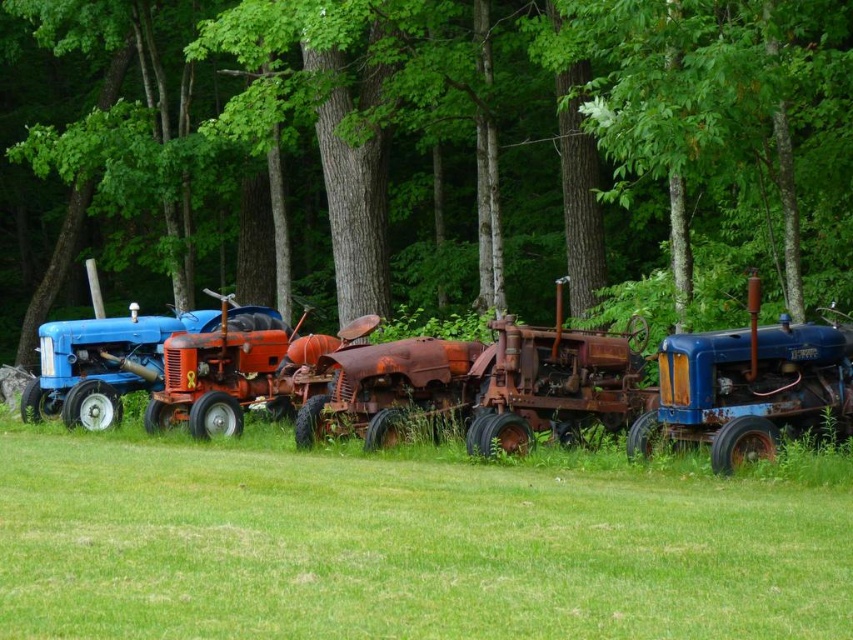
Question: Is green grass at center positioned at the back of rusty metal tractor at center?

Choices:
 (A) no
 (B) yes

Answer: (A)

Question: Can you confirm if green grass at center is positioned to the left of blue matte tractor at right?

Choices:
 (A) yes
 (B) no

Answer: (A)

Question: Which point is farther from the camera taking this photo?

Choices:
 (A) (753, 429)
 (B) (447, 403)

Answer: (B)

Question: Estimate the real-world distances between objects in this image. Which object is closer to the green grass at center?

Choices:
 (A) green leafy tree at center
 (B) blue matte tractor at right
 (C) rusty metal tractor at center

Answer: (B)

Question: Which point is farther to the camera?

Choices:
 (A) (538, 129)
 (B) (567, 488)
 (C) (740, 445)
 (D) (611, 401)

Answer: (A)

Question: Does green leafy tree at center have a larger size compared to rusty metal tractor at center?

Choices:
 (A) no
 (B) yes

Answer: (B)